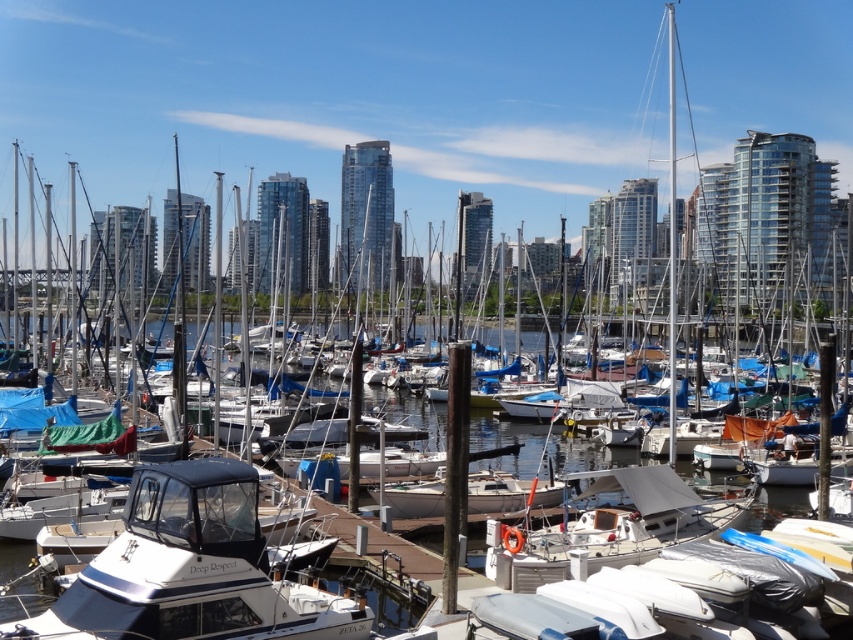
At what (x,y) coordinates should I click in order to perform the action: click on clear water at center. Please return your answer as a coordinate pair (x, y). This screenshot has height=640, width=853. Looking at the image, I should click on (189, 570).

Measure the distance between point (294, 636) and camera.

The distance of point (294, 636) from camera is 24.63 meters.

Locate an element on the screen. This screenshot has width=853, height=640. clear water at center is located at coordinates (189, 570).

Image resolution: width=853 pixels, height=640 pixels. I want to click on clear water at center, so click(x=189, y=570).

Does white matte sailboat at center appear on the left side of white matte boat at center?

Incorrect, white matte sailboat at center is not on the left side of white matte boat at center.

Measure the distance between white matte sailboat at center and camera.

white matte sailboat at center and camera are 27.80 meters apart from each other.

At what (x,y) coordinates should I click in order to perform the action: click on white matte sailboat at center. Please return your answer as a coordinate pair (x, y). Looking at the image, I should click on (608, 525).

Who is higher up, clear water at center or white matte sailboat at center?

clear water at center is above.

Is clear water at center further to the viewer compared to white matte sailboat at center?

No, it is not.

What are the coordinates of `clear water at center` in the screenshot? It's located at (189, 570).